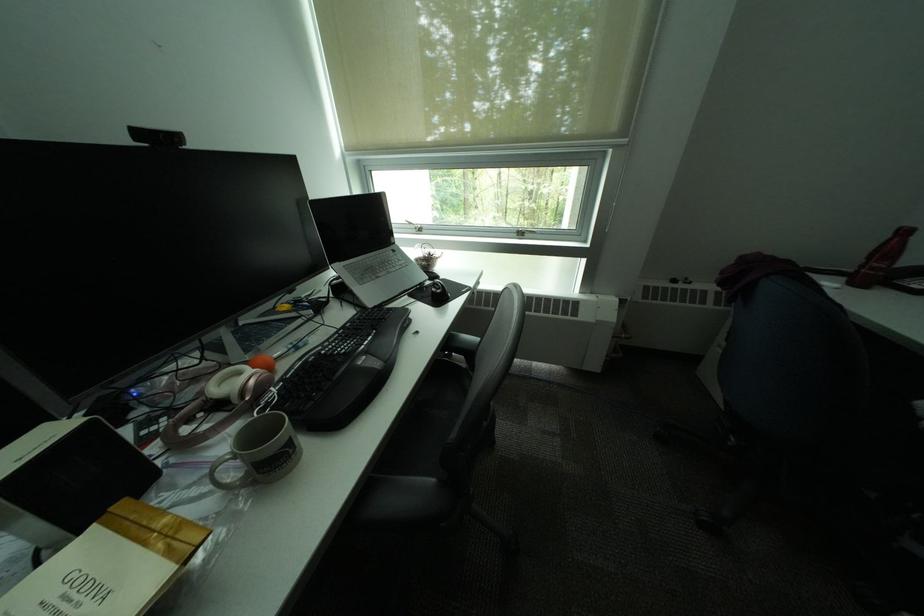
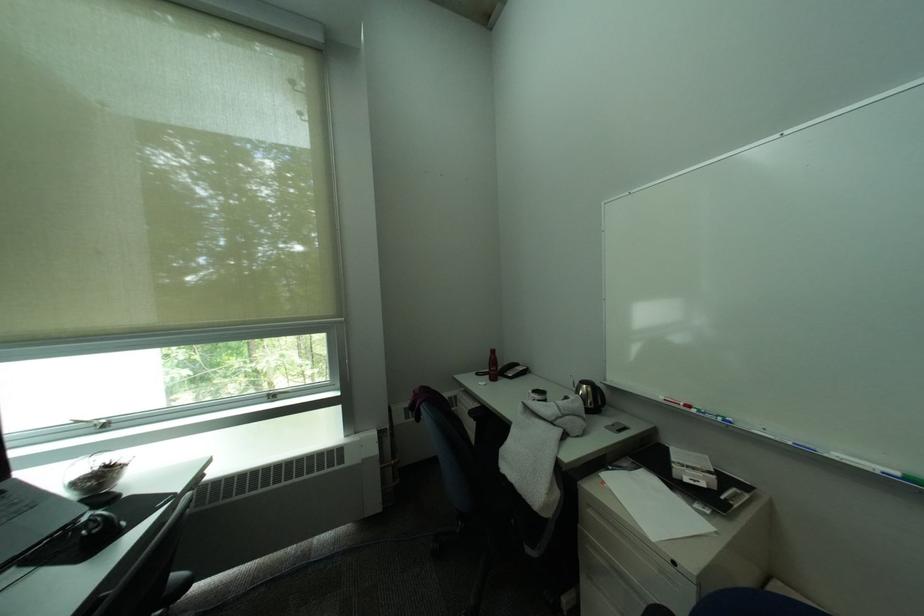
The point at (x=450, y=290) is marked in the first image. Where is the corresponding point in the second image?

(106, 528)